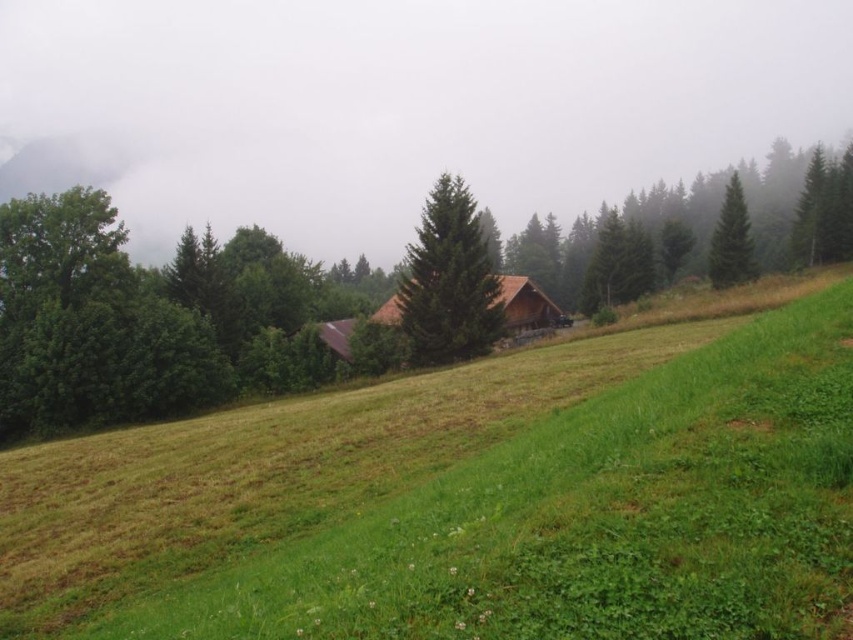
Is green grassy field at center to the right of green matte tree at upper right from the viewer's perspective?

No, green grassy field at center is not to the right of green matte tree at upper right.

Which of these two, green grassy field at center or green matte tree at upper right, stands shorter?

With less height is green grassy field at center.

The height and width of the screenshot is (640, 853). Describe the element at coordinates (469, 499) in the screenshot. I see `green grassy field at center` at that location.

Locate an element on the screen. The height and width of the screenshot is (640, 853). green grassy field at center is located at coordinates tap(469, 499).

Consider the image. Is green leafy forest at center smaller than green matte tree at upper right?

Actually, green leafy forest at center might be larger than green matte tree at upper right.

Is green leafy forest at center wider than green matte tree at upper right?

→ Yes, green leafy forest at center is wider than green matte tree at upper right.

Which is behind, point (787, 154) or point (729, 202)?

Positioned behind is point (787, 154).

Locate an element on the screen. green leafy forest at center is located at coordinates (173, 321).

Is green matte tree at center below green matte tree at upper right?

Yes.

How much distance is there between green matte tree at center and green matte tree at upper right?

136.97 feet

Identify the location of green matte tree at center. (448, 280).